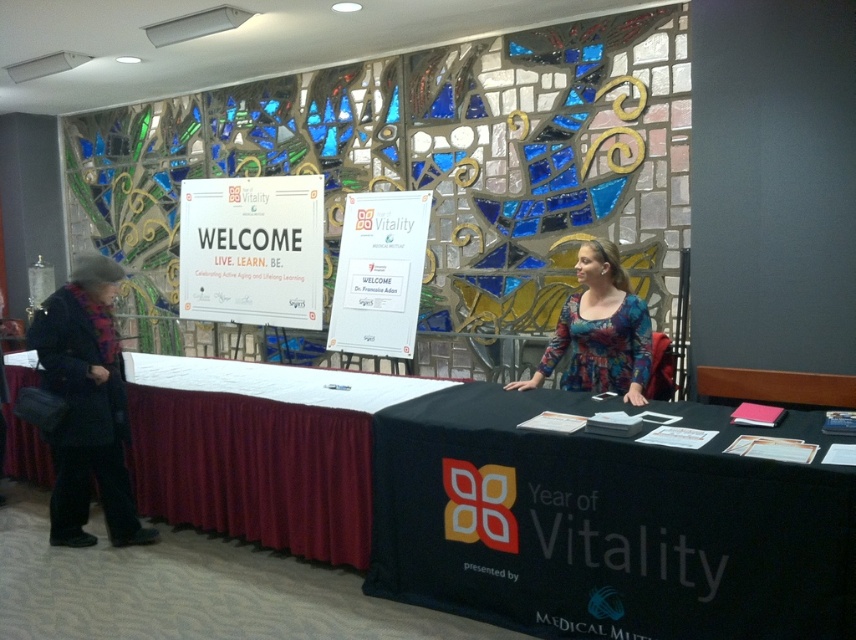
Question: Is dark wool coat at left above multicolored fabric blouse at center?

Choices:
 (A) no
 (B) yes

Answer: (A)

Question: Which of these objects is positioned closest to the black fabric table at center?

Choices:
 (A) white paper sign at center
 (B) dark wool coat at left
 (C) multicolored fabric blouse at center
 (D) white cloth at lower left

Answer: (C)

Question: Among these objects, which one is farthest from the camera?

Choices:
 (A) white paper sign at center
 (B) dark wool coat at left

Answer: (A)

Question: Which object is the closest to the multicolored fabric blouse at center?

Choices:
 (A) white paper sign at center
 (B) dark wool coat at left

Answer: (B)

Question: Observing the image, what is the correct spatial positioning of black fabric table at center in reference to white cloth at lower left?

Choices:
 (A) left
 (B) right

Answer: (B)

Question: Can you confirm if white paper sign at center is positioned above multicolored fabric blouse at center?

Choices:
 (A) no
 (B) yes

Answer: (B)